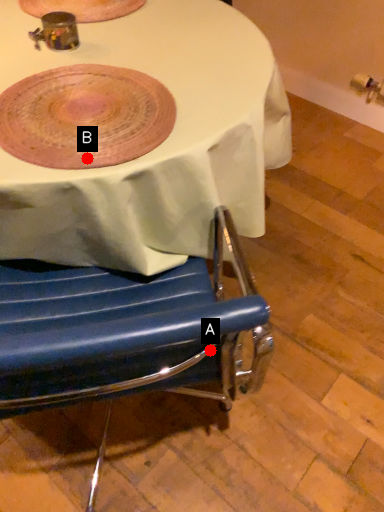
Question: Two points are circled on the image, labeled by A and B beside each circle. Which point is closer to the camera taking this photo?

Choices:
 (A) A is closer
 (B) B is closer

Answer: (A)